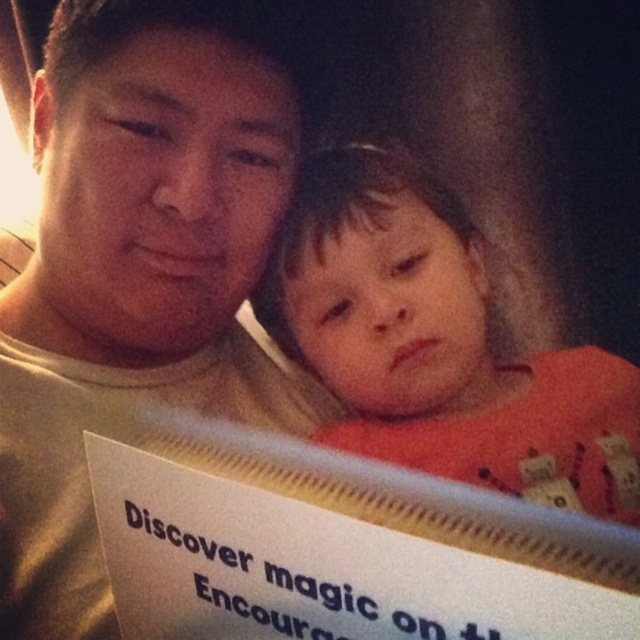
Is point (72, 65) positioned behind point (433, 362)?

Yes, it is.

Is the position of matte beige shirt at center less distant than that of orange cotton shirt at center?

No.

Does point (42, 531) come closer to viewer compared to point (435, 387)?

Yes, it is in front of point (435, 387).

I want to click on matte beige shirt at center, so click(x=140, y=262).